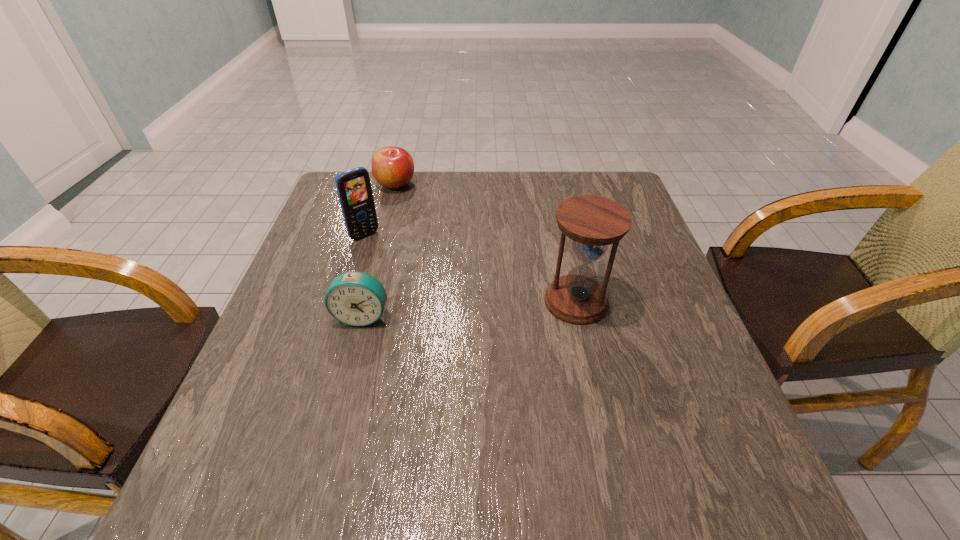
You are a GUI agent. You are given a task and a screenshot of the screen. Output one action in this format:
    pyautogui.click(x=<x>, y=<y>)
    Task: Click on the alarm clock
    
    Given the screenshot: What is the action you would take?
    pyautogui.click(x=354, y=298)

This screenshot has height=540, width=960. What are the coordinates of `the tallest object` in the screenshot? It's located at click(x=592, y=222).

Identify the location of hourglass. The height and width of the screenshot is (540, 960). (592, 222).

Image resolution: width=960 pixels, height=540 pixels. I want to click on the second tallest object, so click(354, 189).

The image size is (960, 540). Identify the location of cellular telephone. (354, 189).

Locate an element on the screen. The height and width of the screenshot is (540, 960). the farthest object is located at coordinates (393, 167).

What are the coordinates of `vacant space located on the front-facing side of the alarm clock` in the screenshot? It's located at (348, 368).

The height and width of the screenshot is (540, 960). I want to click on free space located on the back of the rightmost object, so click(x=561, y=232).

Locate an element on the screen. This screenshot has height=540, width=960. free region located on the screen of the third nearest object is located at coordinates pos(421,291).

Image resolution: width=960 pixels, height=540 pixels. Identify the location of free space located on the screen of the third nearest object. (428, 299).